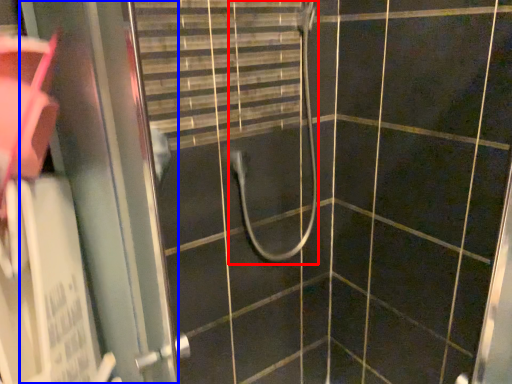
Question: Which of the following is the closest to the observer, shower (highlighted by a red box) or screen door (highlighted by a blue box)?

Choices:
 (A) shower
 (B) screen door

Answer: (B)